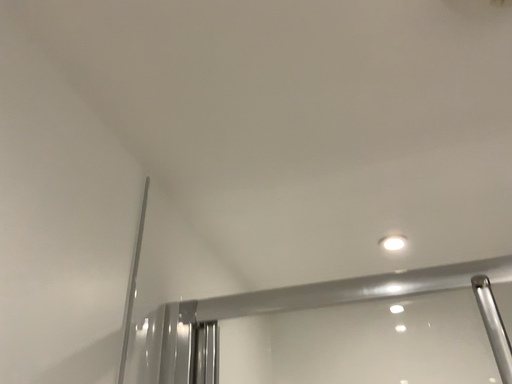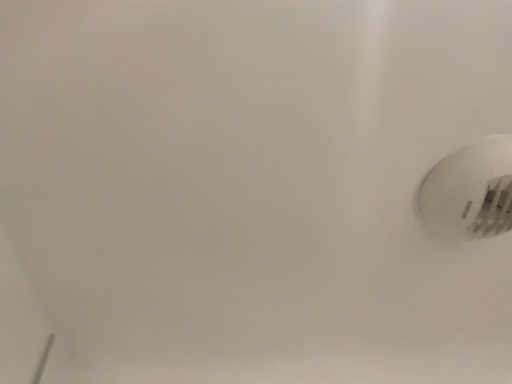
Question: How did the camera likely rotate when shooting the video?

Choices:
 (A) rotated downward
 (B) rotated upward

Answer: (B)